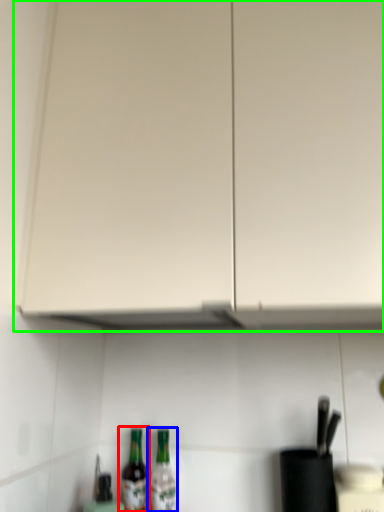
Question: Based on their relative distances, which object is nearer to bottle (highlighted by a red box)? Choose from bottle (highlighted by a blue box) and cabinetry (highlighted by a green box).

Choices:
 (A) bottle
 (B) cabinetry

Answer: (A)